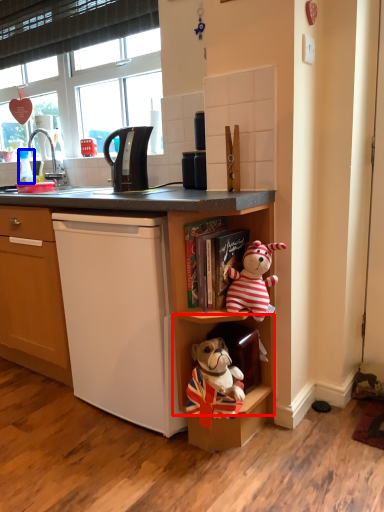
Question: Which object appears farthest to the camera in this image, cabinet (highlighted by a red box) or coffee cup (highlighted by a blue box)?

Choices:
 (A) cabinet
 (B) coffee cup

Answer: (B)